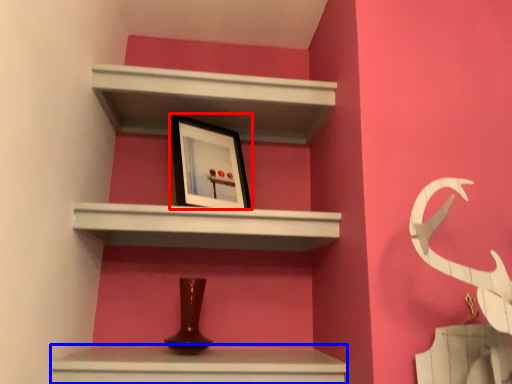
Question: Which point is closer to the camera, picture frame (highlighted by a red box) or vanity (highlighted by a blue box)?

Choices:
 (A) picture frame
 (B) vanity

Answer: (B)